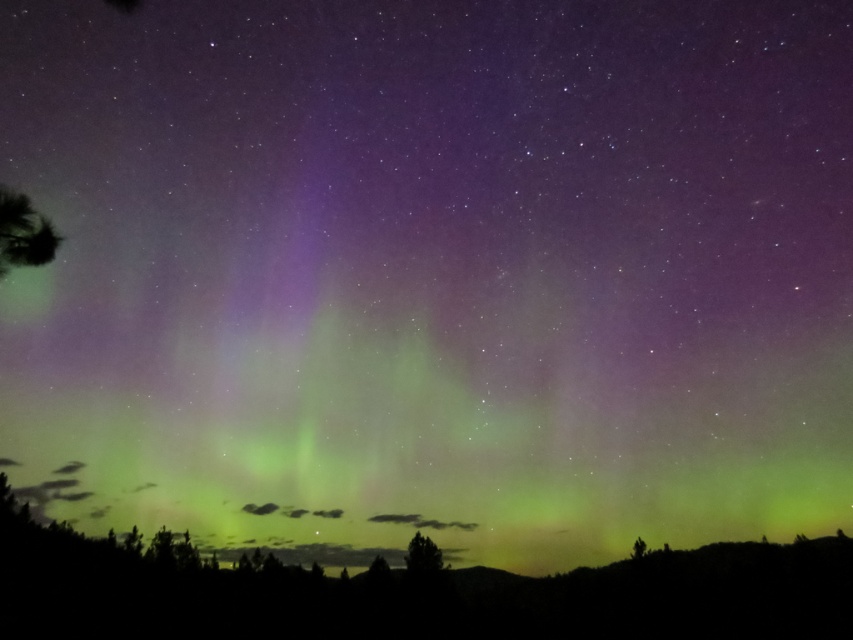
Looking at this image, you are standing in a forest at night and see the aurora borealis. There are two trees in front of you. One is the green leafy tree at left and the other is the green matte tree at lower center. Which tree is positioned to the left?

The green leafy tree at left is positioned to the left of the green matte tree at lower center.